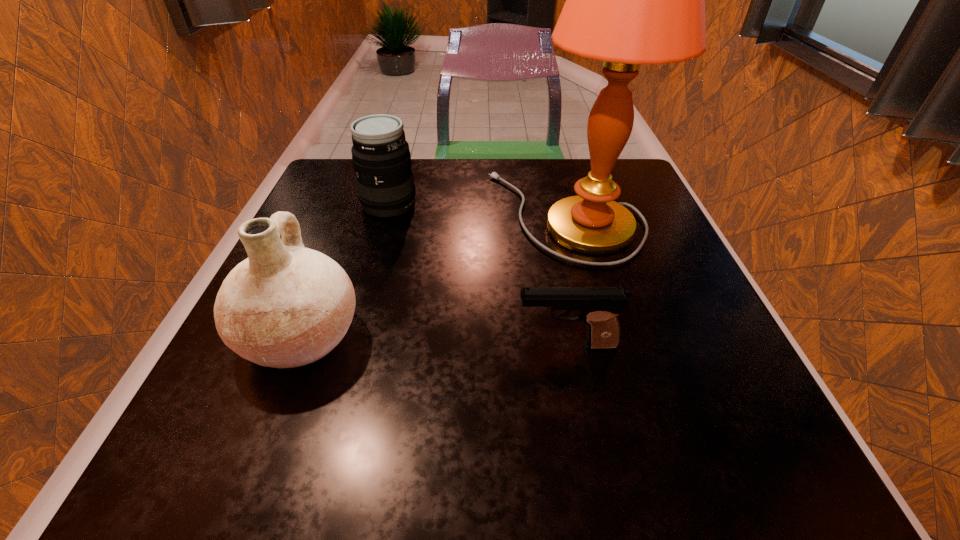
I want to click on lamp positioned at the far edge, so click(x=630, y=0).

Find the location of a particular element. This screenshot has width=960, height=540. telephoto lens at the far edge is located at coordinates (380, 153).

Image resolution: width=960 pixels, height=540 pixels. Identify the location of pottery present at the left edge. (285, 306).

Where is `telephoto lens positioned at the left edge`? Image resolution: width=960 pixels, height=540 pixels. telephoto lens positioned at the left edge is located at coordinates (380, 153).

I want to click on object at the right edge, so click(630, 0).

Where is `object located at the far left corner`? object located at the far left corner is located at coordinates pos(380,153).

What are the coordinates of `object that is at the far right corner` in the screenshot? It's located at (630, 0).

At what (x,y) coordinates should I click in order to perform the action: click on free space at the far edge of the desktop. Please return your answer as a coordinate pair (x, y). This screenshot has height=540, width=960. Looking at the image, I should click on (473, 201).

This screenshot has height=540, width=960. I want to click on free space at the near edge, so click(x=330, y=481).

In order to click on free space at the left edge of the desktop in this screenshot , I will do `click(254, 408)`.